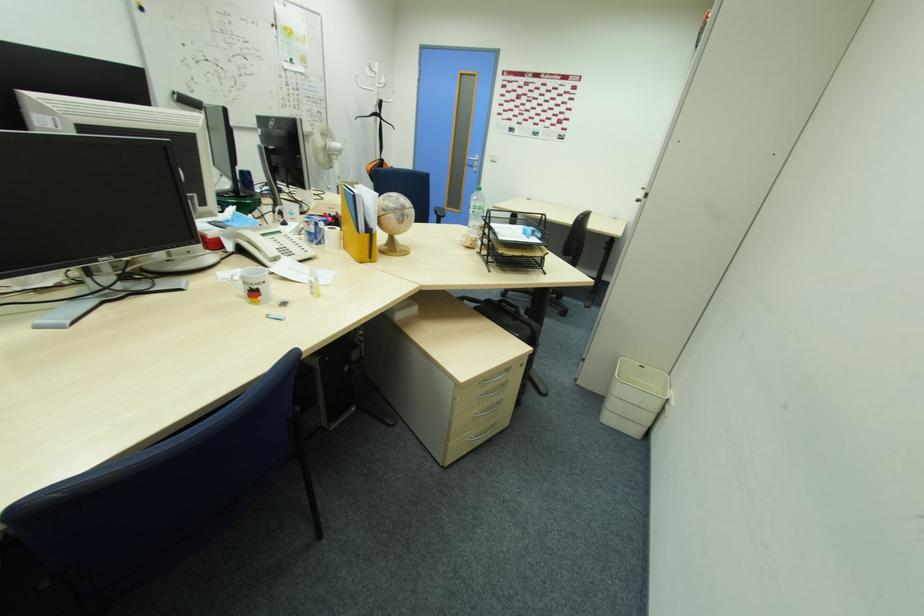
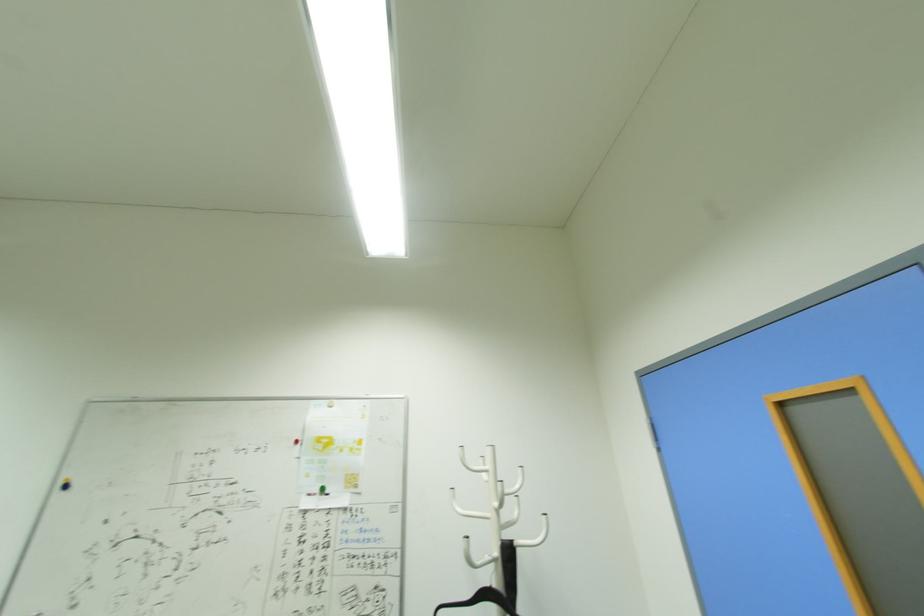
Find the pixel in the second image that matches pixel 381 65 in the first image.

(493, 451)